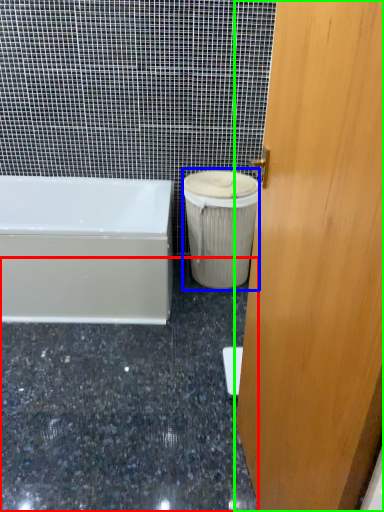
Question: Estimate the real-world distances between objects in this image. Which object is closer to granite (highlighted by a red box), garbage (highlighted by a blue box) or door (highlighted by a green box)?

Choices:
 (A) garbage
 (B) door

Answer: (A)